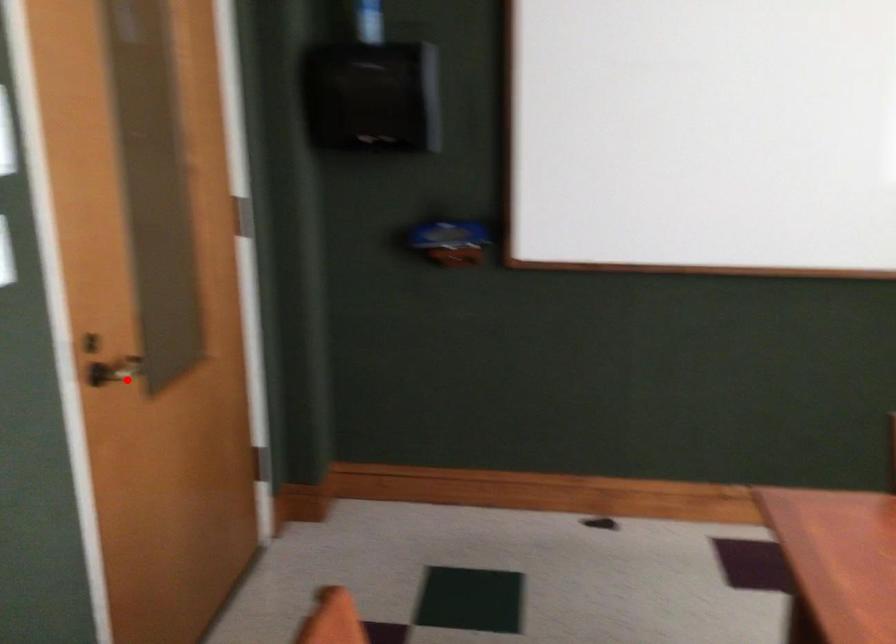
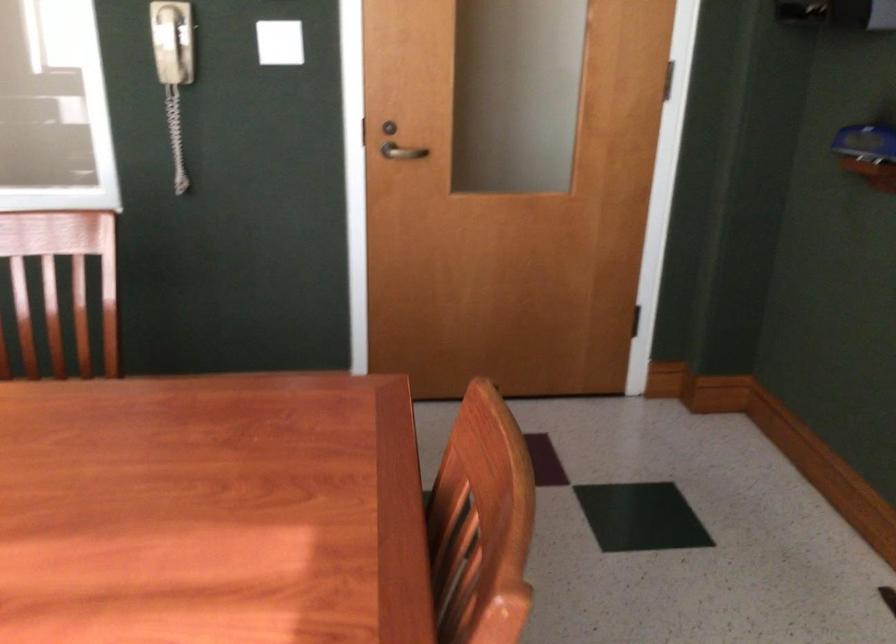
Locate, in the second image, the point that corresponds to the highlighted location in the first image.

(401, 152)